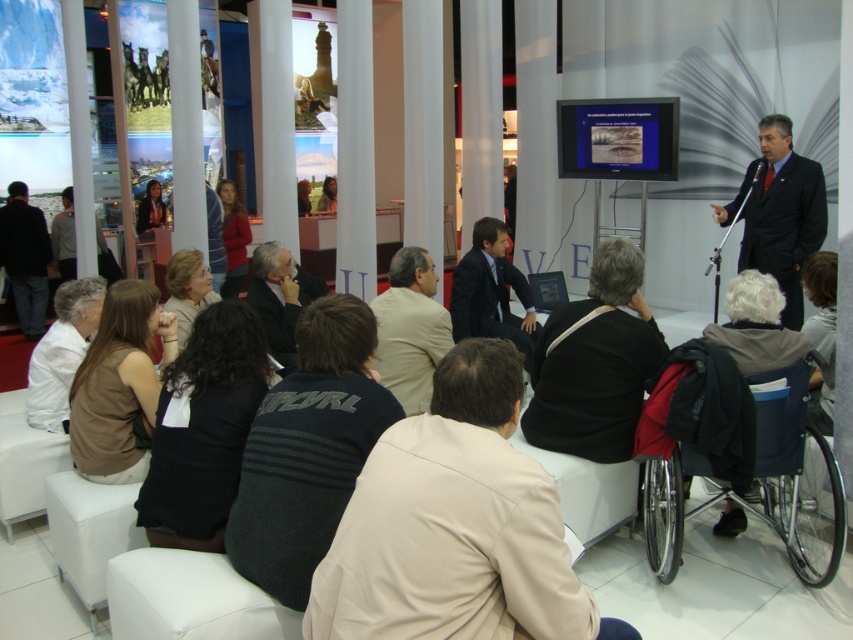
Who is taller, dark gray knit sweater at center or black suit at upper right?

black suit at upper right is taller.

Which of these two, dark gray knit sweater at center or black suit at upper right, stands shorter?

dark gray knit sweater at center

Locate an element on the screen. The height and width of the screenshot is (640, 853). dark gray knit sweater at center is located at coordinates (308, 451).

Can you confirm if beige fabric jacket at center is positioned to the left of black fabric bag at center?

Correct, you'll find beige fabric jacket at center to the left of black fabric bag at center.

Is point (370, 506) closer to camera compared to point (590, 316)?

Yes, it is in front of point (590, 316).

Where is `beige fabric jacket at center`? The height and width of the screenshot is (640, 853). beige fabric jacket at center is located at coordinates (456, 525).

Who is more distant from viewer, (392, 364) or (822, 289)?

Point (392, 364)

The width and height of the screenshot is (853, 640). I want to click on light beige suit at center, so click(410, 330).